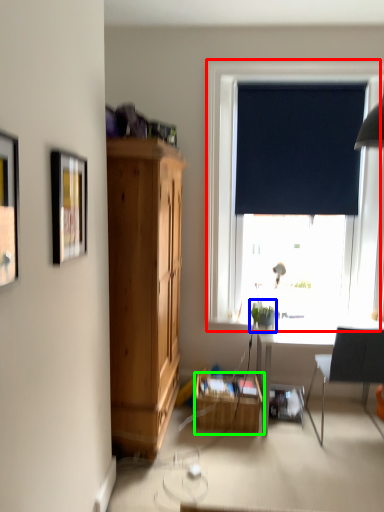
Question: Which object is the closest to the window (highlighted by a red box)? Choose among these: houseplant (highlighted by a blue box) or table (highlighted by a green box).

Choices:
 (A) houseplant
 (B) table

Answer: (A)